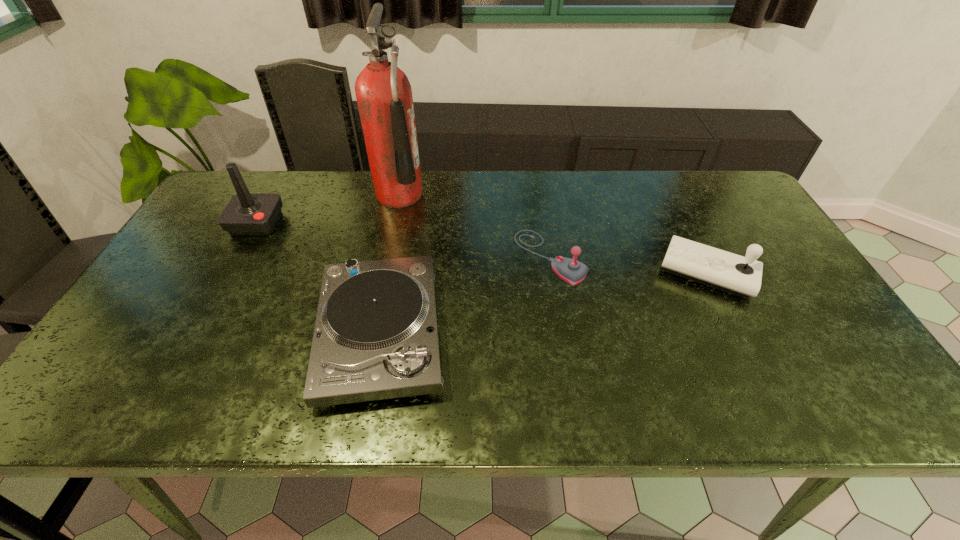
I want to click on free space located 0.130m on the left of the rightmost object, so point(610,272).

Locate an element on the screen. The height and width of the screenshot is (540, 960). free space located on the front of the shortest joystick is located at coordinates (563, 334).

The image size is (960, 540). I want to click on vacant space located 0.070m on the left of the record player, so click(x=283, y=333).

Find the location of a particular element. The image size is (960, 540). fire extinguisher situated at the far edge is located at coordinates (384, 96).

Where is `joystick situated at the far edge`? Image resolution: width=960 pixels, height=540 pixels. joystick situated at the far edge is located at coordinates (247, 214).

The image size is (960, 540). I want to click on object present at the near edge, so click(376, 337).

You are a GUI agent. You are given a task and a screenshot of the screen. Output one action in this format:
    pyautogui.click(x=<x>, y=<y>)
    Task: Click on the object present at the left edge
    
    Given the screenshot: What is the action you would take?
    pyautogui.click(x=247, y=214)

Locate an element on the screen. This screenshot has width=960, height=540. object present at the right edge is located at coordinates click(729, 272).

This screenshot has height=540, width=960. What are the coordinates of `object that is at the far left corner` in the screenshot? It's located at pos(247,214).

Find the location of a particular element. Image resolution: width=960 pixels, height=540 pixels. vacant region at the far edge of the desktop is located at coordinates (372, 195).